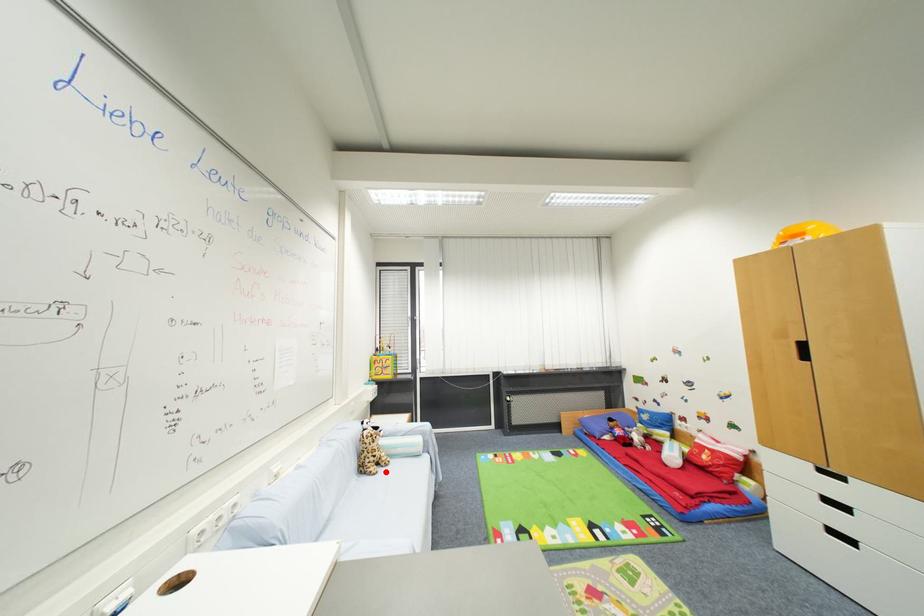
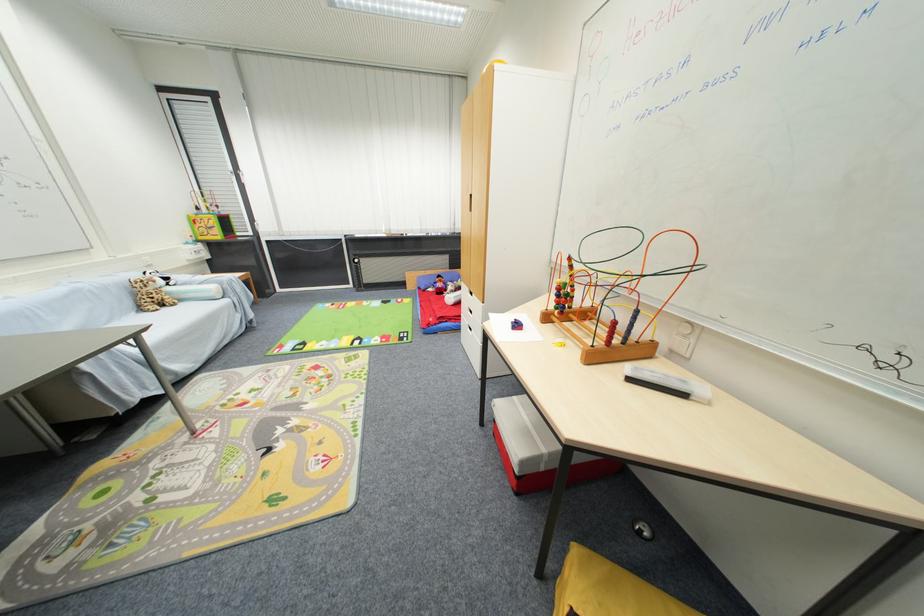
Locate, in the second image, the point that corresponds to the highlighted location in the first image.

(171, 310)